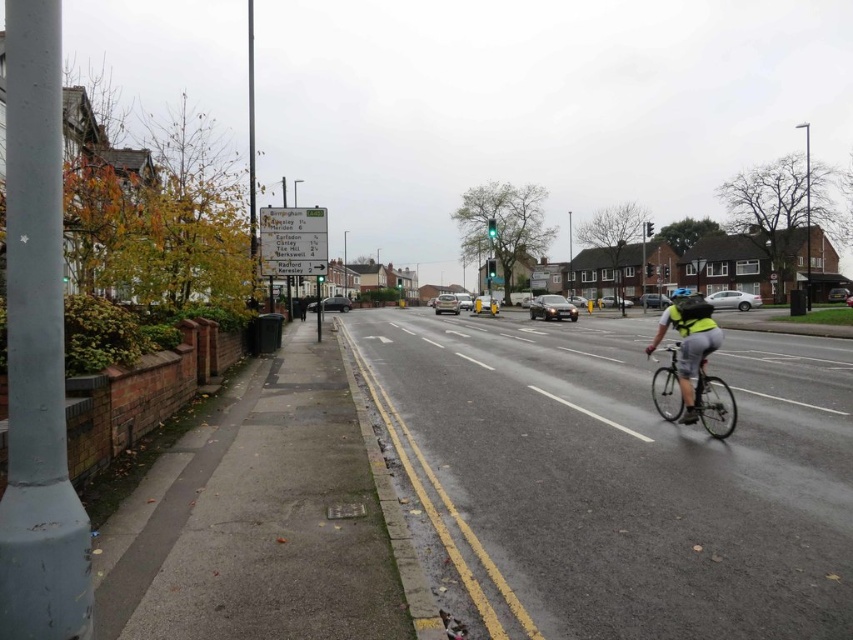
Question: Based on their relative distances, which object is farther from the metallic rectangular sign at center-left?

Choices:
 (A) reflective silver cycling gear at center-right
 (B) silver metallic bicycle at center-right
 (C) matte black helmet at center

Answer: (C)

Question: Is metallic rectangular sign at center-left in front of silver metallic bicycle at center-right?

Choices:
 (A) no
 (B) yes

Answer: (A)

Question: Which object appears farthest from the camera in this image?

Choices:
 (A) matte black helmet at center
 (B) silver metallic bicycle at center-right

Answer: (A)

Question: Does black asphalt bike lane at center come in front of matte black helmet at center?

Choices:
 (A) no
 (B) yes

Answer: (B)

Question: Does black asphalt bike lane at center come in front of metallic rectangular sign at center-left?

Choices:
 (A) no
 (B) yes

Answer: (B)

Question: Among these points, which one is nearest to the camera?

Choices:
 (A) (656, 381)
 (B) (693, 410)
 (C) (675, 292)

Answer: (B)